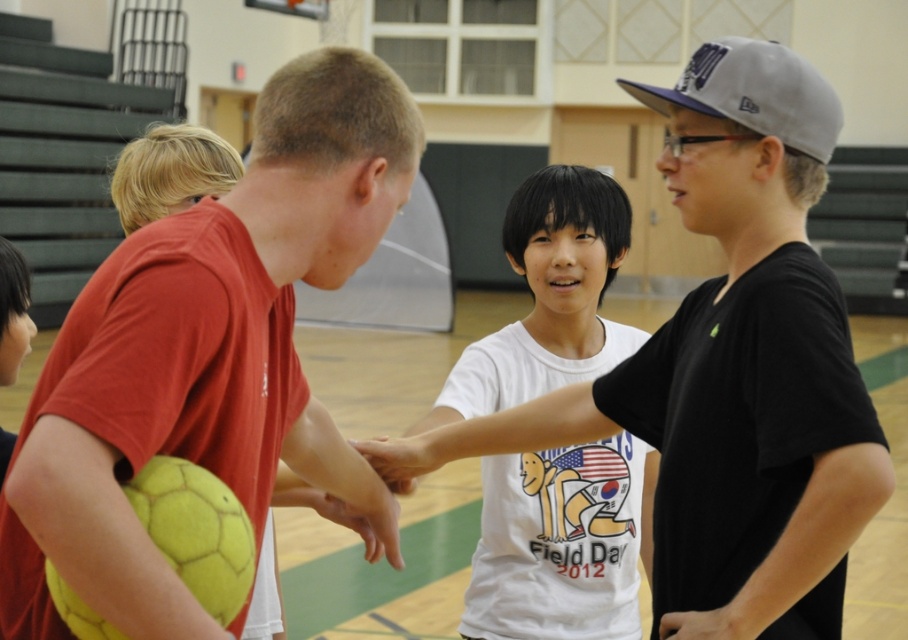
Question: Is white matte shirt at center thinner than white cotton shirt at center?

Choices:
 (A) yes
 (B) no

Answer: (B)

Question: Based on their relative distances, which object is nearer to the white matte shirt at center?

Choices:
 (A) matte yellow soccer ball at left
 (B) white cotton shirt at center

Answer: (B)

Question: Can you confirm if matte yellow soccer ball at left is positioned above white matte shirt at center?

Choices:
 (A) no
 (B) yes

Answer: (A)

Question: Among these objects, which one is farthest from the camera?

Choices:
 (A) white cotton shirt at center
 (B) white matte shirt at center
 (C) matte yellow soccer ball at left

Answer: (A)

Question: Is matte yellow soccer ball at left thinner than white matte shirt at center?

Choices:
 (A) no
 (B) yes

Answer: (B)

Question: Estimate the real-world distances between objects in this image. Which object is closer to the white matte shirt at center?

Choices:
 (A) matte yellow soccer ball at left
 (B) white cotton shirt at center

Answer: (B)